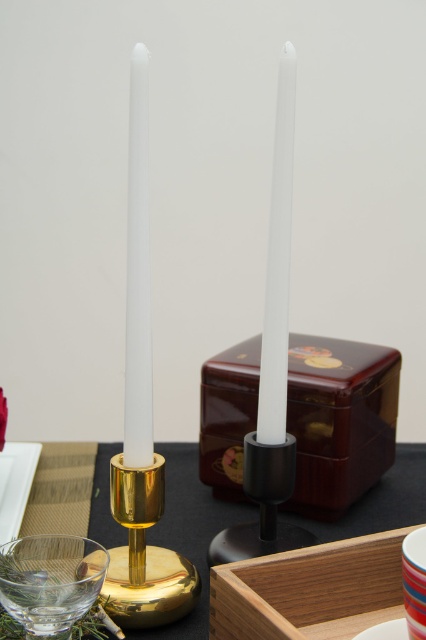
You are arranging flowers for a centerpiece and need to place a vase between the gold metallic candlestick at center and the white matte candle at left. Based on their positions, where should the vase be placed?

The gold metallic candlestick at center is positioned under the white matte candle at left, so the vase should be placed between them, above the gold metallic candlestick at center and below the white matte candle at left.

You are a server in a restaurant. You need to place a 7.5 inch long decorative item between the white matte candle at center and the transparent glass at lower left. Can you fit it there?

The distance between the white matte candle at center and the transparent glass at lower left is 6.93 inches. Since the decorative item is 7.5 inches long, it cannot fit in the space provided.

What are the coordinates of the gold metallic candlestick at center?

The gold metallic candlestick at center is located at coordinates point (189,532).